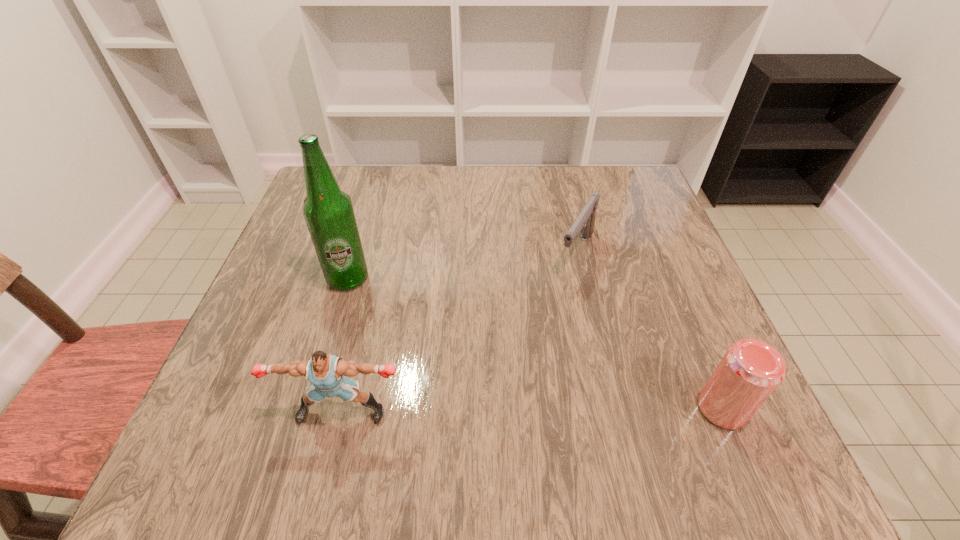
What are the coordinates of `vacant space that is in between the third object from left to right and the puncher` in the screenshot? It's located at (459, 332).

Identify the location of free spot between the rightmost object and the beer bottle. The image size is (960, 540). (535, 343).

The height and width of the screenshot is (540, 960). Find the location of `vacant region between the beer bottle and the puncher`. vacant region between the beer bottle and the puncher is located at coordinates (345, 345).

You are a GUI agent. You are given a task and a screenshot of the screen. Output one action in this format:
    pyautogui.click(x=<x>, y=<y>)
    Task: Click on the unoccupied area between the rightmost object and the puncher
    
    Given the screenshot: What is the action you would take?
    pyautogui.click(x=532, y=410)

You are a GUI agent. You are given a task and a screenshot of the screen. Output one action in this format:
    pyautogui.click(x=<x>, y=<y>)
    Task: Click on the empty space that is in between the rightmost object and the shortest object
    The image size is (960, 540).
    Given the screenshot: What is the action you would take?
    pyautogui.click(x=649, y=330)

What are the coordinates of `vacant space that is in between the shortest object and the puncher` in the screenshot? It's located at (459, 332).

Locate which object ranks in proximity to the beer bottle. Please provide its 2D coordinates. Your answer should be formatted as a tuple, i.e. [(x, y)], where the tuple contains the x and y coordinates of a point satisfying the conditions above.

[(325, 373)]

Locate which object is the closest to the puncher. Please provide its 2D coordinates. Your answer should be formatted as a tuple, i.e. [(x, y)], where the tuple contains the x and y coordinates of a point satisfying the conditions above.

[(328, 211)]